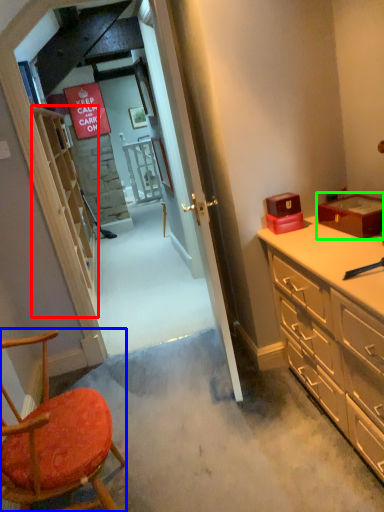
Question: Estimate the real-world distances between objects in this image. Which object is farther from shelf (highlighted by a red box), chair (highlighted by a blue box) or box (highlighted by a green box)?

Choices:
 (A) chair
 (B) box

Answer: (B)